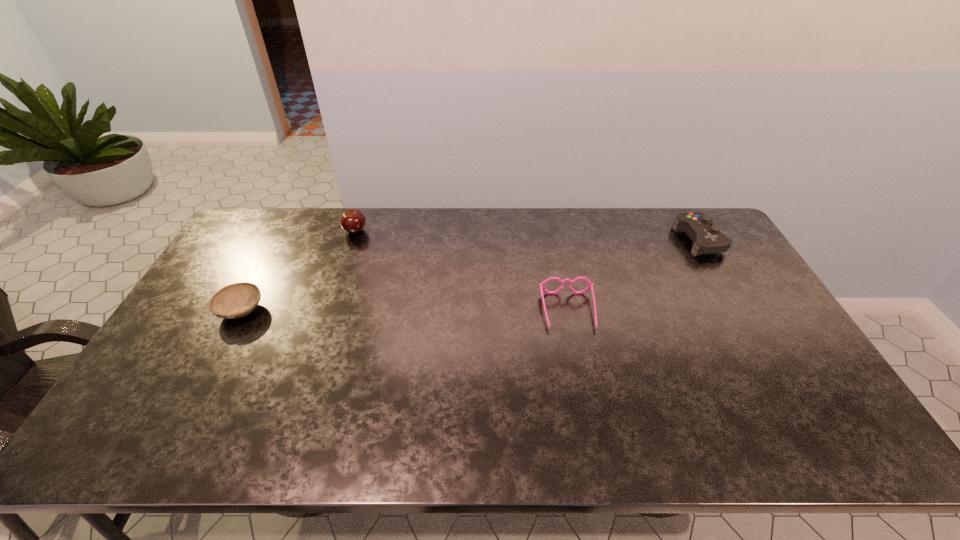
Where is `object that is the second closest to the shortest object`? The image size is (960, 540). object that is the second closest to the shortest object is located at coordinates (541, 285).

Locate an element on the screen. free location that satisfies the following two spatial constraints: 1. on the back side of the rightmost object; 2. on the left side of the shortest object is located at coordinates (278, 241).

Where is `free region that satisfies the following two spatial constraints: 1. on the back side of the bowl; 2. on the right side of the rightmost object`? free region that satisfies the following two spatial constraints: 1. on the back side of the bowl; 2. on the right side of the rightmost object is located at coordinates (278, 241).